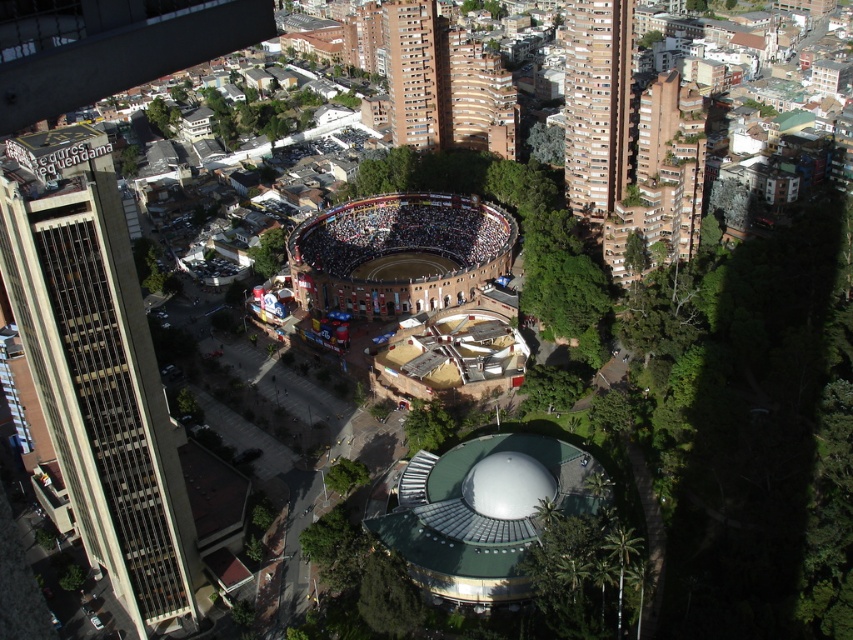
Between brown brick building at upper right and brown brick arena at center, which one has more height?

Standing taller between the two is brown brick building at upper right.

Between point (569, 144) and point (331, 260), which one is positioned in front?

Point (331, 260) is in front.

I want to click on brown brick building at upper right, so click(596, 104).

Can you confirm if beige concrete tower at left is bigger than brown brick arena at center?

Yes.

Does beige concrete tower at left appear under brown brick arena at center?

Indeed, beige concrete tower at left is positioned under brown brick arena at center.

Who is more distant from viewer, (103,561) or (323,244)?

Positioned behind is point (323,244).

Find the location of `beige concrete tower at left`. beige concrete tower at left is located at coordinates (96, 368).

Who is positioned more to the right, beige concrete tower at left or brown brick building at upper right?

From the viewer's perspective, brown brick building at upper right appears more on the right side.

Who is higher up, beige concrete tower at left or brown brick building at upper right?

brown brick building at upper right

Which is behind, point (10, 161) or point (596, 168)?

Point (596, 168)

Where is `beige concrete tower at left`? The width and height of the screenshot is (853, 640). beige concrete tower at left is located at coordinates [x=96, y=368].